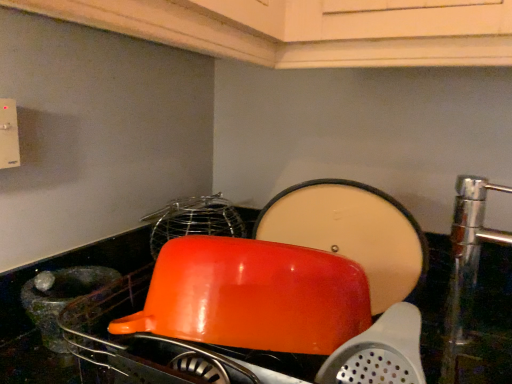
Question: Is glossy plastic bowl at center shorter than glossy orange bowl at center?

Choices:
 (A) yes
 (B) no

Answer: (B)

Question: Is glossy plastic bowl at center positioned beyond the bounds of glossy orange bowl at center?

Choices:
 (A) yes
 (B) no

Answer: (A)

Question: Is glossy plastic bowl at center wider than glossy orange bowl at center?

Choices:
 (A) no
 (B) yes

Answer: (B)

Question: From the image's perspective, is glossy plastic bowl at center below glossy orange bowl at center?

Choices:
 (A) no
 (B) yes

Answer: (B)

Question: Can you confirm if glossy plastic bowl at center is positioned to the right of glossy orange bowl at center?

Choices:
 (A) no
 (B) yes

Answer: (B)

Question: Relative to translucent glass mortar at left, is glossy plastic bowl at center in front or behind?

Choices:
 (A) behind
 (B) front

Answer: (B)

Question: Looking at their shapes, would you say glossy plastic bowl at center is wider or thinner than translucent glass mortar at left?

Choices:
 (A) thin
 (B) wide

Answer: (B)

Question: Would you say glossy plastic bowl at center is inside or outside translucent glass mortar at left?

Choices:
 (A) outside
 (B) inside

Answer: (A)

Question: Is glossy plastic bowl at center bigger or smaller than translucent glass mortar at left?

Choices:
 (A) small
 (B) big

Answer: (B)

Question: From the image's perspective, is glossy orange bowl at center above or below translucent glass mortar at left?

Choices:
 (A) above
 (B) below

Answer: (A)

Question: Which is correct: glossy orange bowl at center is inside translucent glass mortar at left, or outside of it?

Choices:
 (A) inside
 (B) outside

Answer: (B)

Question: Looking at the image, does glossy orange bowl at center seem bigger or smaller compared to translucent glass mortar at left?

Choices:
 (A) small
 (B) big

Answer: (B)

Question: From their relative heights in the image, would you say glossy orange bowl at center is taller or shorter than translucent glass mortar at left?

Choices:
 (A) tall
 (B) short

Answer: (A)

Question: In terms of width, does glossy orange bowl at center look wider or thinner when compared to glossy plastic bowl at center?

Choices:
 (A) thin
 (B) wide

Answer: (A)

Question: Is point (287, 283) positioned closer to the camera than point (498, 286)?

Choices:
 (A) closer
 (B) farther

Answer: (A)